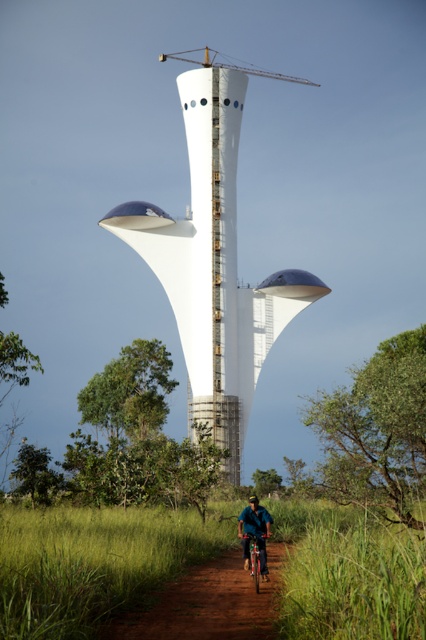
Question: Which point is farther to the camera?

Choices:
 (A) (245, 557)
 (B) (222, 61)
 (C) (218, 384)
 (D) (238, 525)

Answer: (B)

Question: Does white smooth tower at center appear under blue fabric jacket at center?

Choices:
 (A) yes
 (B) no

Answer: (B)

Question: Which object appears closest to the camera in this image?

Choices:
 (A) white smooth tower at center
 (B) blue fabric jacket at center
 (C) metallic gray crane at upper center
 (D) metallic silver bicycle at center

Answer: (D)

Question: From the image, what is the correct spatial relationship of brown dirt track at center in relation to blue fabric jacket at center?

Choices:
 (A) below
 (B) above

Answer: (A)

Question: Can you confirm if white smooth tower at center is positioned below metallic gray crane at upper center?

Choices:
 (A) yes
 (B) no

Answer: (A)

Question: Which point is farther to the camera?

Choices:
 (A) metallic silver bicycle at center
 (B) brown dirt track at center
 (C) metallic gray crane at upper center
 (D) white smooth tower at center

Answer: (C)